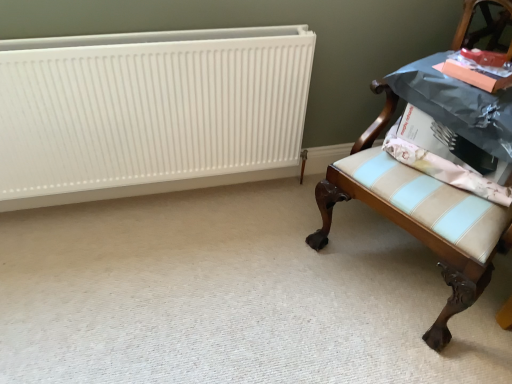
This screenshot has height=384, width=512. What are the coordinates of `vacant area to the right of white matte radiator at upper left` in the screenshot? It's located at (269, 262).